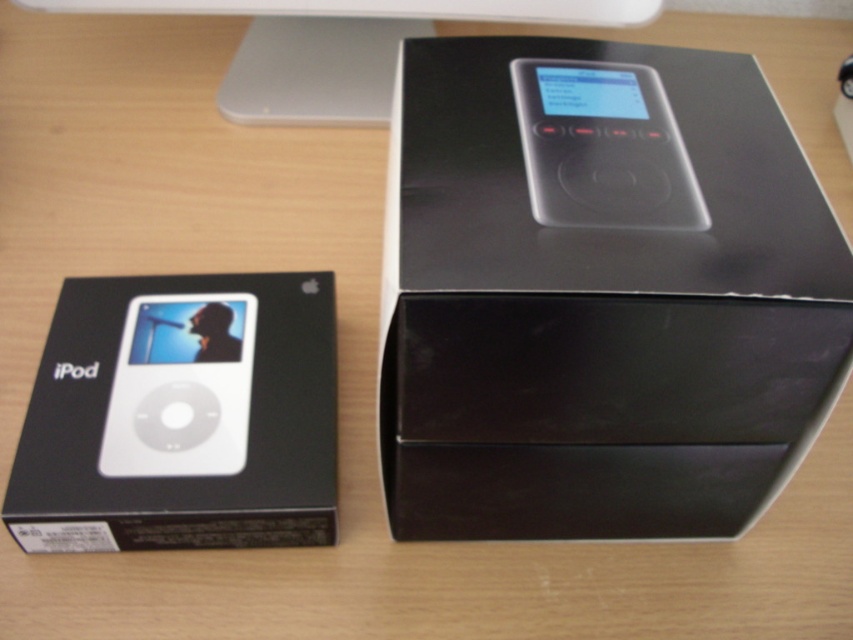
Does black matte box at upper center come behind white matte ipod at center?

No, black matte box at upper center is in front of white matte ipod at center.

Looking at this image, can you confirm if black matte box at upper center is bigger than white matte ipod at center?

Correct, black matte box at upper center is larger in size than white matte ipod at center.

Is point (795, 236) more distant than point (126, 336)?

No.

You are a GUI agent. You are given a task and a screenshot of the screen. Output one action in this format:
    pyautogui.click(x=<x>, y=<y>)
    Task: Click on the black matte box at upper center
    
    Given the screenshot: What is the action you would take?
    pyautogui.click(x=599, y=292)

Who is higher up, white matte ipod at center or white glossy ipod at center?

white glossy ipod at center is higher up.

Which is behind, point (236, 320) or point (198, 433)?

Positioned behind is point (236, 320).

Is point (59, 486) farther from camera compared to point (247, 384)?

No, it is in front of (247, 384).

Find the location of `white matte ipod at center`. white matte ipod at center is located at coordinates (181, 417).

Is point (206, 349) farther from camera compared to point (570, 186)?

Yes, it is behind point (570, 186).

This screenshot has height=640, width=853. Find the location of `white matte ipod at center`. white matte ipod at center is located at coordinates (181, 417).

Is point (140, 493) closer to camera compared to point (672, 115)?

No, it is behind (672, 115).

The width and height of the screenshot is (853, 640). I want to click on white matte ipod at center, so click(x=181, y=417).